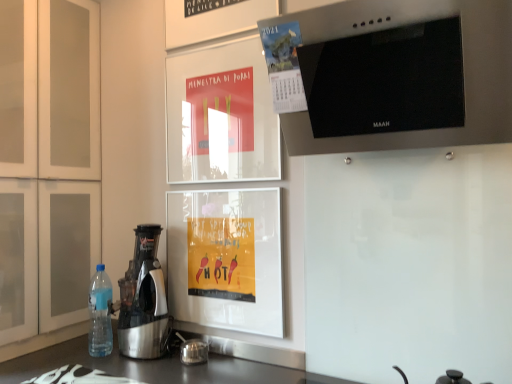
Question: Can you confirm if white matte cabinet at left is smaller than blue plastic bottle at lower left?

Choices:
 (A) no
 (B) yes

Answer: (A)

Question: Is white matte cabinet at left next to blue plastic bottle at lower left?

Choices:
 (A) yes
 (B) no

Answer: (B)

Question: From the image's perspective, does white matte cabinet at left appear lower than blue plastic bottle at lower left?

Choices:
 (A) yes
 (B) no

Answer: (B)

Question: Can you confirm if white matte cabinet at left is taller than blue plastic bottle at lower left?

Choices:
 (A) no
 (B) yes

Answer: (B)

Question: Can you confirm if white matte cabinet at left is positioned to the right of blue plastic bottle at lower left?

Choices:
 (A) no
 (B) yes

Answer: (A)

Question: Could blue plastic bottle at lower left be considered to be inside white matte cabinet at left?

Choices:
 (A) yes
 (B) no

Answer: (B)

Question: Does stainless steel range hood at upper right have a lesser height compared to white matte cabinet at left?

Choices:
 (A) yes
 (B) no

Answer: (A)

Question: Does stainless steel range hood at upper right have a lesser width compared to white matte cabinet at left?

Choices:
 (A) no
 (B) yes

Answer: (B)

Question: From the image's perspective, does stainless steel range hood at upper right appear lower than white matte cabinet at left?

Choices:
 (A) no
 (B) yes

Answer: (A)

Question: Are stainless steel range hood at upper right and white matte cabinet at left located far from each other?

Choices:
 (A) no
 (B) yes

Answer: (B)

Question: From a real-world perspective, is stainless steel range hood at upper right under white matte cabinet at left?

Choices:
 (A) yes
 (B) no

Answer: (B)

Question: Is stainless steel range hood at upper right bigger than white matte cabinet at left?

Choices:
 (A) yes
 (B) no

Answer: (B)

Question: Can you confirm if white matte cabinet at left is thinner than stainless steel range hood at upper right?

Choices:
 (A) no
 (B) yes

Answer: (A)